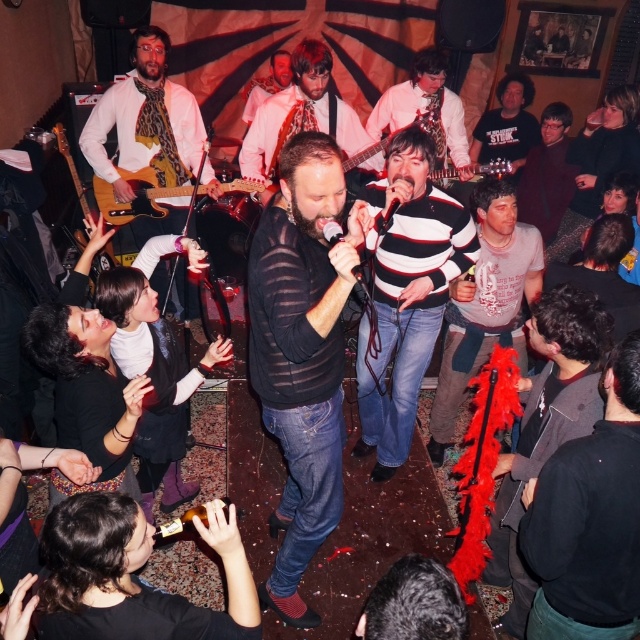
You are a photographer standing at the center of the venue. You want to take a photo of the light brown wood electric guitar at upper left. Where should you position yourself to capture the guitar in the frame?

The light brown wood electric guitar at upper left is located at point (140, 196). To capture it in your frame, position yourself so that your camera is aimed towards that coordinate.

You are a stagehand setting up equipment. You need to move the black matte microphone at center to the right side of the stage. Currently, the light brown wood electric guitar at upper left is blocking the path. Can you move the guitar first to make space?

The light brown wood electric guitar at upper left is to the left of the black matte microphone at center. To move the microphone to the right, you can first move the guitar to the left, freeing the path so the microphone can be moved without obstruction.